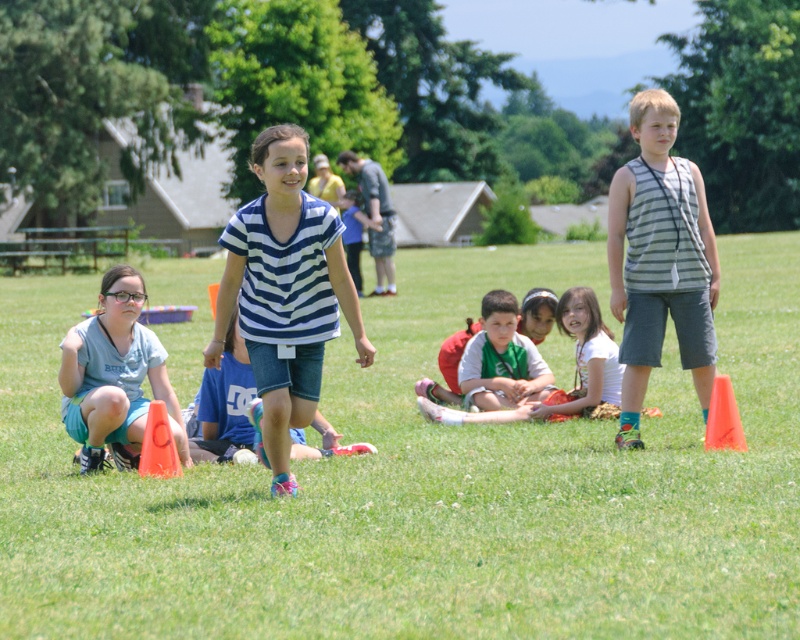
Between striped fabric shirt at center and light blue denim shorts at lower left, which one is positioned higher?

striped fabric shirt at center is higher up.

Who is positioned more to the left, striped fabric shirt at center or light blue denim shorts at lower left?

light blue denim shorts at lower left is more to the left.

Where is `striped fabric shirt at center`? Image resolution: width=800 pixels, height=640 pixels. striped fabric shirt at center is located at coordinates (284, 294).

Can you confirm if green grassy field at center is positioned to the left of striped fabric shirt at center?

Correct, you'll find green grassy field at center to the left of striped fabric shirt at center.

Is green grassy field at center behind striped fabric shirt at center?

No, it is in front of striped fabric shirt at center.

Does point (718, 595) lie in front of point (296, 346)?

That is True.

Locate an element on the screen. green grassy field at center is located at coordinates (424, 486).

Who is positioned more to the right, orange plastic cone at lower left or orange plastic cone at lower right?

From the viewer's perspective, orange plastic cone at lower right appears more on the right side.

Can you confirm if orange plastic cone at lower left is positioned to the right of orange plastic cone at lower right?

No, orange plastic cone at lower left is not to the right of orange plastic cone at lower right.

Does point (162, 461) come in front of point (736, 433)?

That is True.

The width and height of the screenshot is (800, 640). Find the location of `orange plastic cone at lower left`. orange plastic cone at lower left is located at coordinates (158, 444).